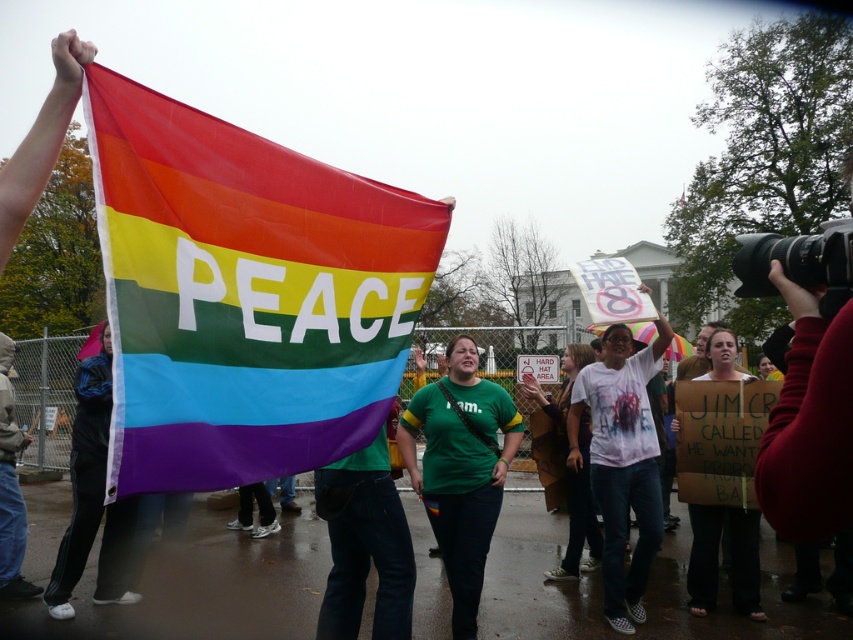
Which is in front, point (442, 470) or point (340, 556)?

Point (340, 556) is in front.

Does green t-shirt at center appear on the left side of green denim jeans at center?

In fact, green t-shirt at center is to the right of green denim jeans at center.

Is point (450, 401) positioned in front of point (335, 621)?

No.

The width and height of the screenshot is (853, 640). What are the coordinates of `green t-shirt at center` in the screenshot? It's located at (461, 468).

This screenshot has height=640, width=853. What do you see at coordinates (244, 294) in the screenshot? I see `rainbow fabric flag at upper left` at bounding box center [244, 294].

The image size is (853, 640). Describe the element at coordinates (244, 294) in the screenshot. I see `rainbow fabric flag at upper left` at that location.

I want to click on rainbow fabric flag at upper left, so click(x=244, y=294).

Based on the photo, can you confirm if green denim jeans at center is wider than white cotton shirt at center?

In fact, green denim jeans at center might be narrower than white cotton shirt at center.

Between point (403, 528) and point (552, 416), which one is positioned in front?

Point (403, 528) is more forward.

The height and width of the screenshot is (640, 853). Find the location of `green denim jeans at center`. green denim jeans at center is located at coordinates (364, 545).